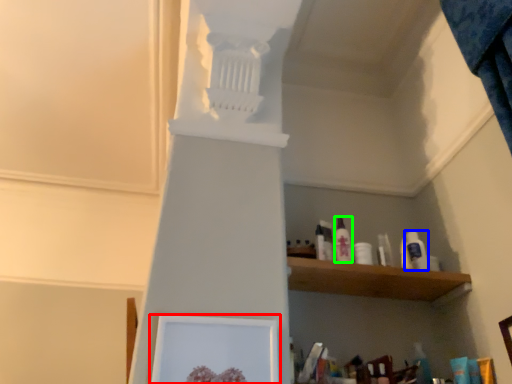
Question: Estimate the real-world distances between objects in this image. Which object is farther from picture frame (highlighted by a red box), toiletry (highlighted by a blue box) or toiletry (highlighted by a green box)?

Choices:
 (A) toiletry
 (B) toiletry

Answer: (A)